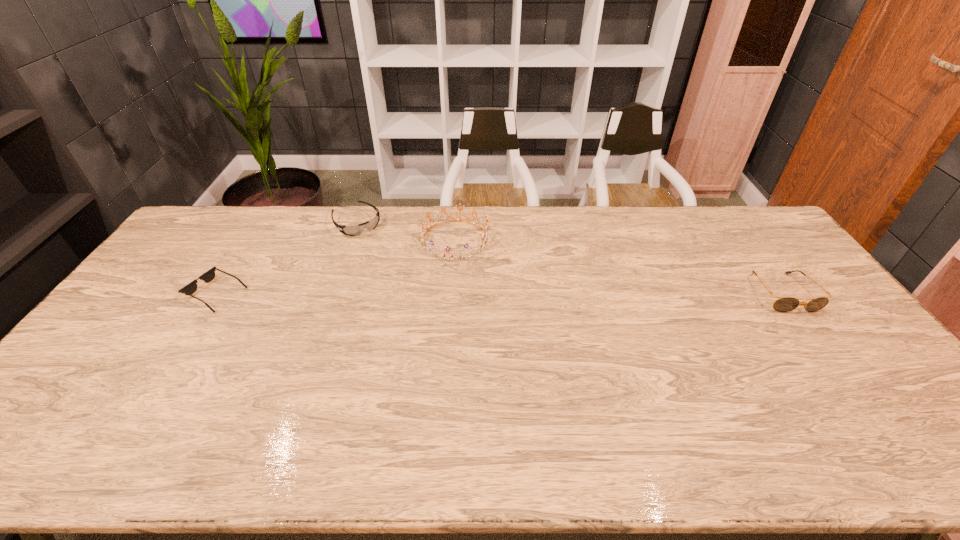
The image size is (960, 540). I want to click on the leftmost sunglasses, so click(207, 277).

This screenshot has height=540, width=960. What are the coordinates of `the shortest object` in the screenshot? It's located at (207, 277).

The image size is (960, 540). Identify the location of the tallest sunglasses. (785, 304).

At what (x,y) coordinates should I click in order to perform the action: click on the rightmost object. Please return your answer as a coordinate pair (x, y). Looking at the image, I should click on (785, 304).

Where is `tiara`? The height and width of the screenshot is (540, 960). tiara is located at coordinates (484, 241).

Identify the location of the third object from left to right. (484, 241).

At what (x,y) coordinates should I click in order to perform the action: click on the third object from right to left. Please return your answer as a coordinate pair (x, y). This screenshot has width=960, height=540. Looking at the image, I should click on (355, 230).

The height and width of the screenshot is (540, 960). Identify the location of the third tallest object. (355, 230).

Where is `blank area located 0.090m on the lenses of the shortest object`? This screenshot has width=960, height=540. blank area located 0.090m on the lenses of the shortest object is located at coordinates (158, 294).

You are a GUI agent. You are given a task and a screenshot of the screen. Output one action in this format:
    pyautogui.click(x=<x>, y=<y>)
    Task: Click on the free space located on the lenses of the shortest object
    The width and height of the screenshot is (960, 540).
    Given the screenshot: What is the action you would take?
    pyautogui.click(x=172, y=294)